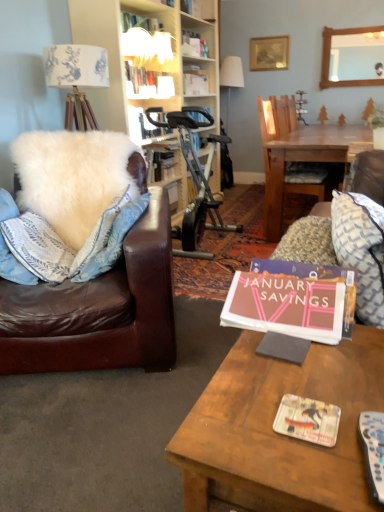
This screenshot has width=384, height=512. Identify the location of vacant space situated above wooden table at center (from a real-world perspective). (300, 377).